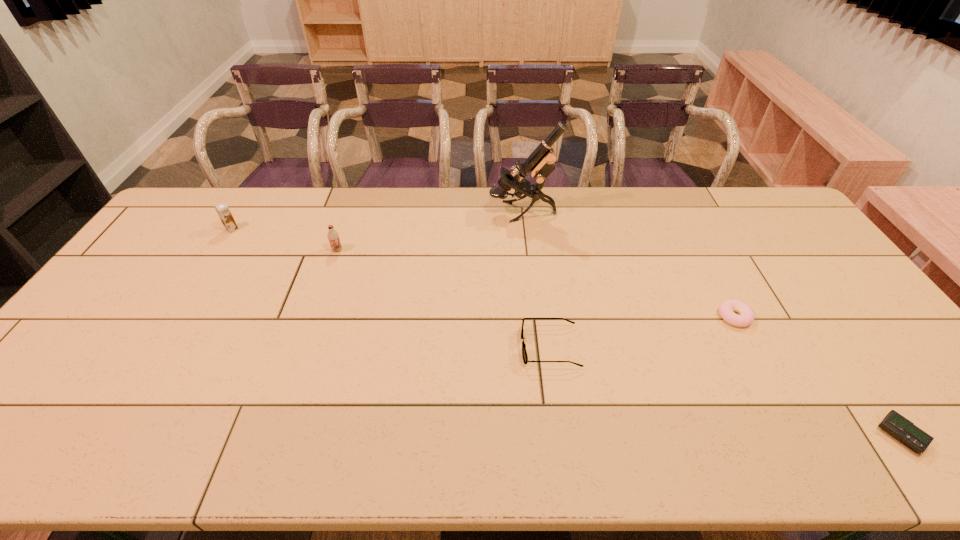
Where is `free space between the spectacles and the second object from right to left`? free space between the spectacles and the second object from right to left is located at coordinates (642, 332).

Find the location of `object that is the fifth closest to the third shortest object`. object that is the fifth closest to the third shortest object is located at coordinates (222, 209).

Find the location of a particular element. This screenshot has height=540, width=960. object that is the fourth closest to the nearer chocolate milk is located at coordinates (726, 308).

At what (x,y) coordinates should I click in order to perform the action: click on vacant space that satisfies the following two spatial constraints: 1. on the back side of the second object from right to left; 2. through the eyepiece of the microscope. Please return your answer as a coordinate pair (x, y). This screenshot has width=960, height=540. Looking at the image, I should click on (679, 212).

The height and width of the screenshot is (540, 960). In order to click on free location that satisfies the following two spatial constraints: 1. on the front side of the shortest object; 2. on the right side of the third farthest object in this screenshot , I will do `click(274, 435)`.

Locate an element on the screen. Image resolution: width=960 pixels, height=540 pixels. free space that satisfies the following two spatial constraints: 1. through the eyepiece of the fifth tallest object; 2. on the right side of the tallest object is located at coordinates (534, 316).

Find the location of a particular element. vacant region that satisfies the following two spatial constraints: 1. on the front side of the fourth nearest object; 2. on the right side of the second shortest object is located at coordinates (314, 316).